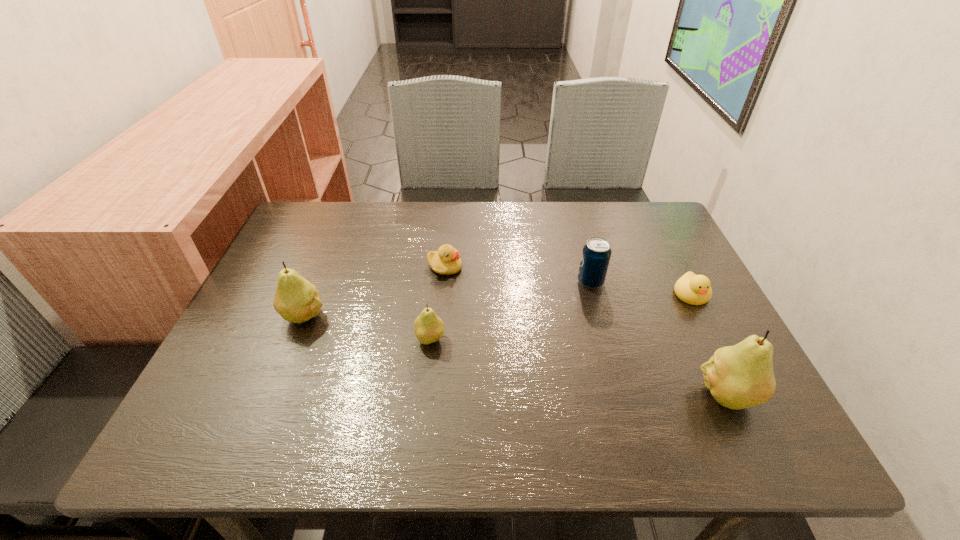
Locate an element on the screen. The image size is (960, 540). empty space between the left duckling and the shortest pear is located at coordinates (438, 303).

Where is `vacant space in between the right duckling and the farther duckling`? vacant space in between the right duckling and the farther duckling is located at coordinates (568, 281).

This screenshot has width=960, height=540. Identify the location of vacant space that is in between the leftmost object and the second pear from left to right. (368, 327).

Locate an element on the screen. empty space that is in between the leftmost pear and the nearer duckling is located at coordinates (498, 305).

Where is `the closest object relative to the second pear from right to left`? The width and height of the screenshot is (960, 540). the closest object relative to the second pear from right to left is located at coordinates (446, 261).

Identify which object is the third closest to the right duckling. Please provide its 2D coordinates. Your answer should be formatted as a tuple, i.e. [(x, y)], where the tuple contains the x and y coordinates of a point satisfying the conditions above.

[(446, 261)]

You are a GUI agent. You are given a task and a screenshot of the screen. Output one action in this format:
    pyautogui.click(x=<x>, y=<y>)
    Task: Click on the closest pear to the left duckling
    Image resolution: width=960 pixels, height=540 pixels.
    Given the screenshot: What is the action you would take?
    pyautogui.click(x=429, y=328)

Identify the location of pear that stands as the third closest to the right duckling. (297, 300).

Find the location of `vacant region that satisfies the following two spatial constraints: 1. on the front side of the second pear from left to right; 2. on the right side of the rightmost pear`. vacant region that satisfies the following two spatial constraints: 1. on the front side of the second pear from left to right; 2. on the right side of the rightmost pear is located at coordinates (424, 394).

Identify the location of vacant space that satisfies the following two spatial constraints: 1. on the front side of the second tallest pear; 2. on the right side of the second pear from right to left. The width and height of the screenshot is (960, 540). (295, 339).